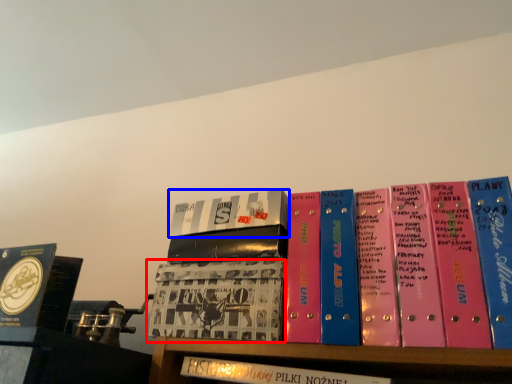
Question: Among these objects, which one is farthest to the camera, book (highlighted by a red box) or book (highlighted by a blue box)?

Choices:
 (A) book
 (B) book

Answer: (B)